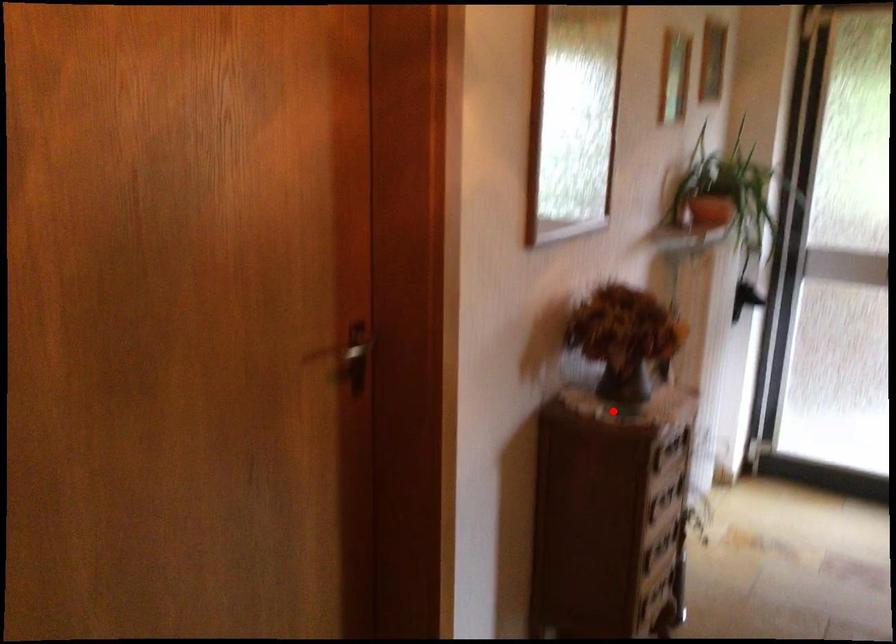
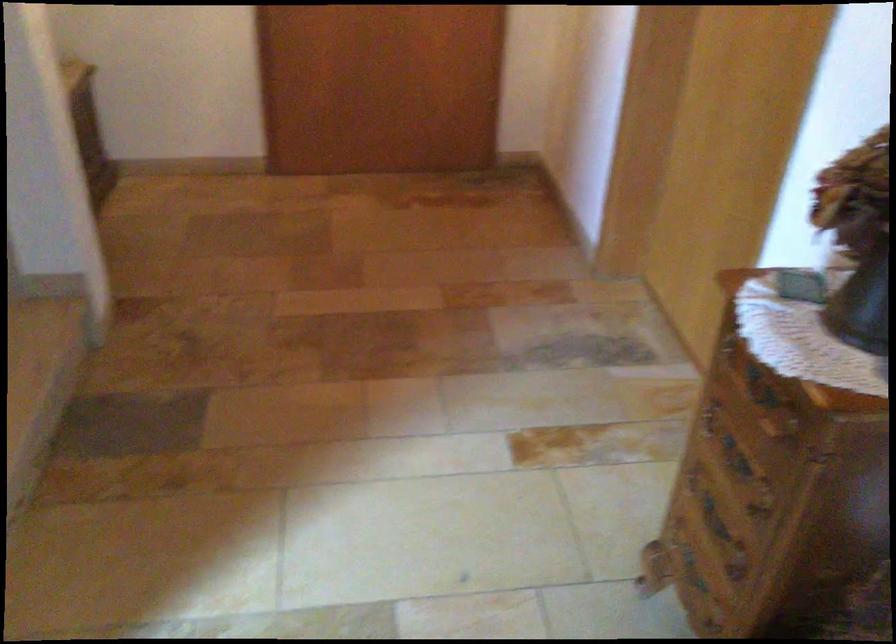
Locate, in the second image, the point that corresponds to the highlighted location in the first image.

(863, 303)